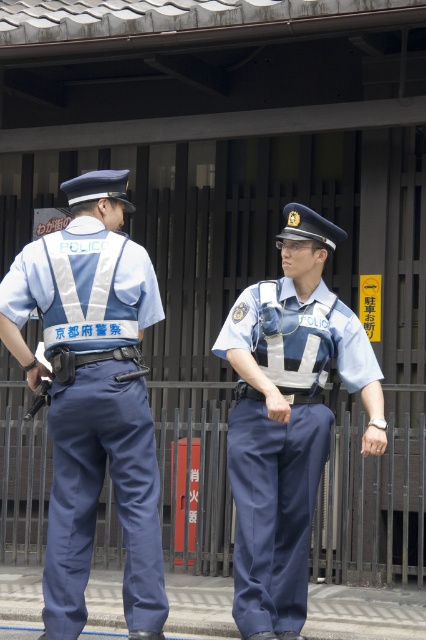
Measure the distance between blue uniform at center and camera.

blue uniform at center is 22.77 feet from camera.

How distant is blue uniform at center from blue fabric uniform at left?

They are 57.80 centimeters apart.

Does point (71, 291) come in front of point (106, 404)?

No.

Locate an element on the screen. This screenshot has width=426, height=640. blue uniform at center is located at coordinates (92, 396).

Is blue uniform at center smaller than navy blue fabric uniform at center?

Actually, blue uniform at center might be larger than navy blue fabric uniform at center.

Between point (281, 472) and point (241, 298), which one is positioned behind?

Point (241, 298)

This screenshot has height=640, width=426. In order to click on blue uniform at center in this screenshot , I will do `click(92, 396)`.

Is blue fabric uniform at left thinner than navy blue fabric uniform at center?

Indeed, blue fabric uniform at left has a lesser width compared to navy blue fabric uniform at center.

From the picture: Which of these two, blue fabric uniform at left or navy blue fabric uniform at center, stands shorter?

navy blue fabric uniform at center

Locate an element on the screen. The width and height of the screenshot is (426, 640). blue fabric uniform at left is located at coordinates (92, 406).